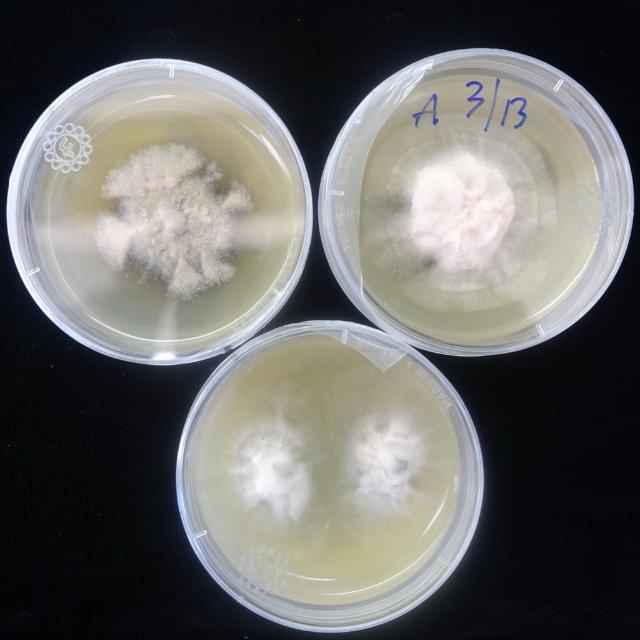
Question: Is white fluffy substance at center closer to camera compared to white fluffy mold at center?

Choices:
 (A) yes
 (B) no

Answer: (B)

Question: Among these objects, which one is farthest from the camera?

Choices:
 (A) white fluffy substance at center
 (B) white fluffy mold at center

Answer: (A)

Question: Which point is farther to the camera?

Choices:
 (A) white fluffy substance at center
 (B) white fluffy mold at center

Answer: (A)

Question: Can you confirm if white fluffy substance at center is wider than white fluffy mold at center?

Choices:
 (A) yes
 (B) no

Answer: (A)

Question: Does white fluffy substance at center have a smaller size compared to white fluffy mold at center?

Choices:
 (A) yes
 (B) no

Answer: (B)